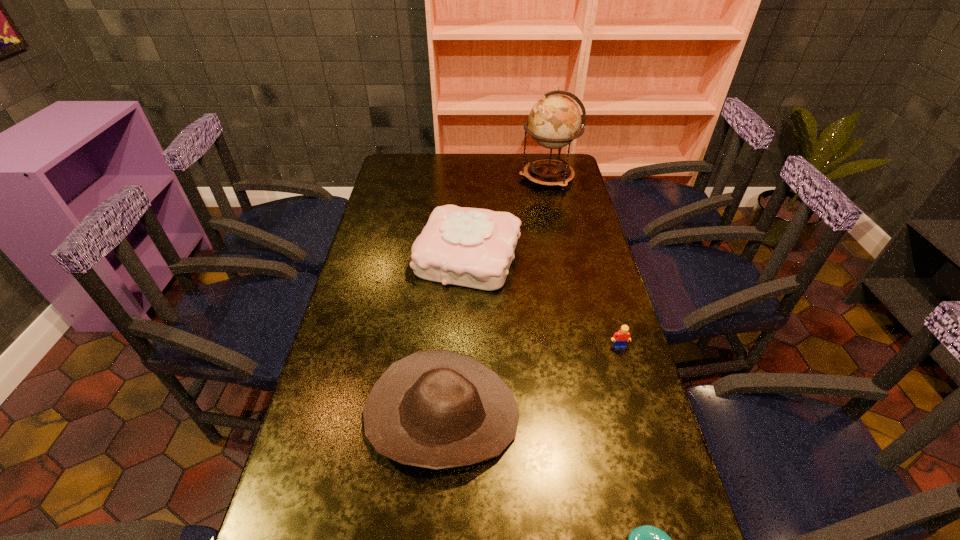
Image resolution: width=960 pixels, height=540 pixels. What are the coordinates of `the tallest object` in the screenshot? It's located at (554, 122).

At what (x,y) coordinates should I click in order to perform the action: click on the farthest object. Please return your answer as a coordinate pair (x, y). This screenshot has height=540, width=960. Looking at the image, I should click on (554, 122).

Where is `the second farthest object`? The image size is (960, 540). the second farthest object is located at coordinates (471, 247).

This screenshot has height=540, width=960. What are the coordinates of `cowboy hat` in the screenshot? It's located at (436, 409).

At what (x,y) coordinates should I click in order to perform the action: click on the second shortest object. Please return your answer as a coordinate pair (x, y). Looking at the image, I should click on (620, 338).

The width and height of the screenshot is (960, 540). What are the coordinates of `the third nearest object` in the screenshot? It's located at (620, 338).

The width and height of the screenshot is (960, 540). Identify the location of vacant space located 0.290m at the center of the tallest object. (451, 177).

Where is `vacant space located 0.340m at the center of the tallest object`? This screenshot has height=540, width=960. vacant space located 0.340m at the center of the tallest object is located at coordinates (440, 177).

Image resolution: width=960 pixels, height=540 pixels. What are the coordinates of `vacant position located at the center of the tallest object` in the screenshot? It's located at 481,177.

This screenshot has width=960, height=540. I want to click on blank space located on the right of the cake, so click(x=594, y=256).